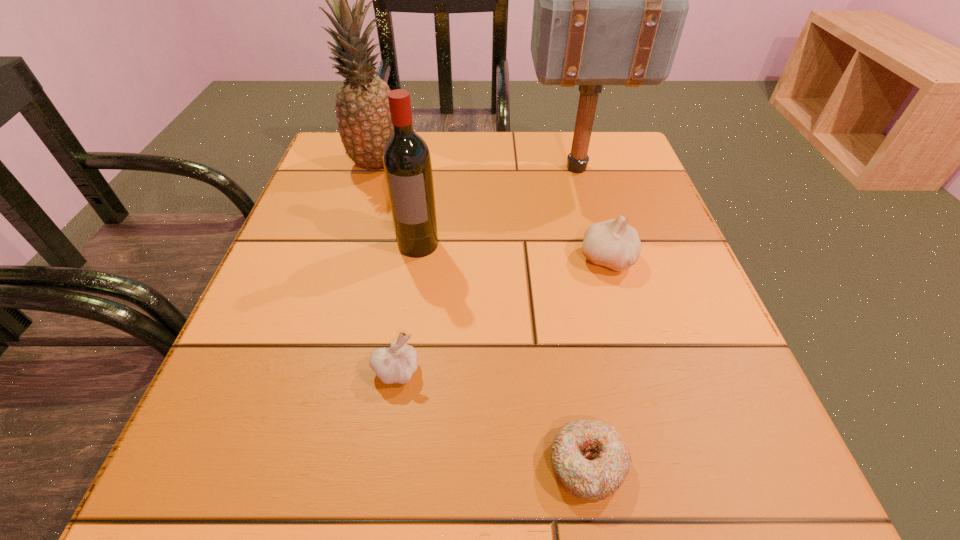
I want to click on free space at the near left corner of the desktop, so (293, 497).

Find the location of a particular element. free space at the far right corner of the desktop is located at coordinates (615, 133).

Find the location of a particular element. free spot between the wine bottle and the taller garlic is located at coordinates (513, 252).

Where is `empty space that is in between the mallet and the wine bottle`? Image resolution: width=960 pixels, height=540 pixels. empty space that is in between the mallet and the wine bottle is located at coordinates (498, 206).

The height and width of the screenshot is (540, 960). I want to click on free space between the pineapple and the doughnut, so click(x=482, y=314).

Identify the location of vacant space that is in between the doughnut and the taller garlic. (597, 362).

The width and height of the screenshot is (960, 540). I want to click on vacant region between the mallet and the shorter garlic, so (487, 269).

Locate an element on the screen. The width and height of the screenshot is (960, 540). free space between the farther garlic and the third tallest object is located at coordinates (513, 252).

Where is `free spot between the nearest object and the leftmost object`? free spot between the nearest object and the leftmost object is located at coordinates (482, 314).

Where is `unoccupied position between the wine bottle and the mallet`? Image resolution: width=960 pixels, height=540 pixels. unoccupied position between the wine bottle and the mallet is located at coordinates (498, 206).